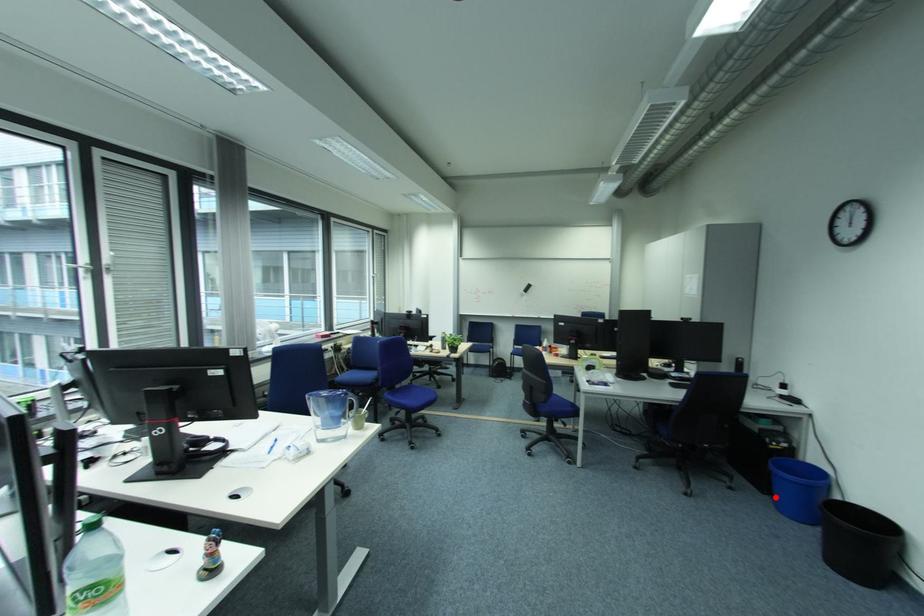
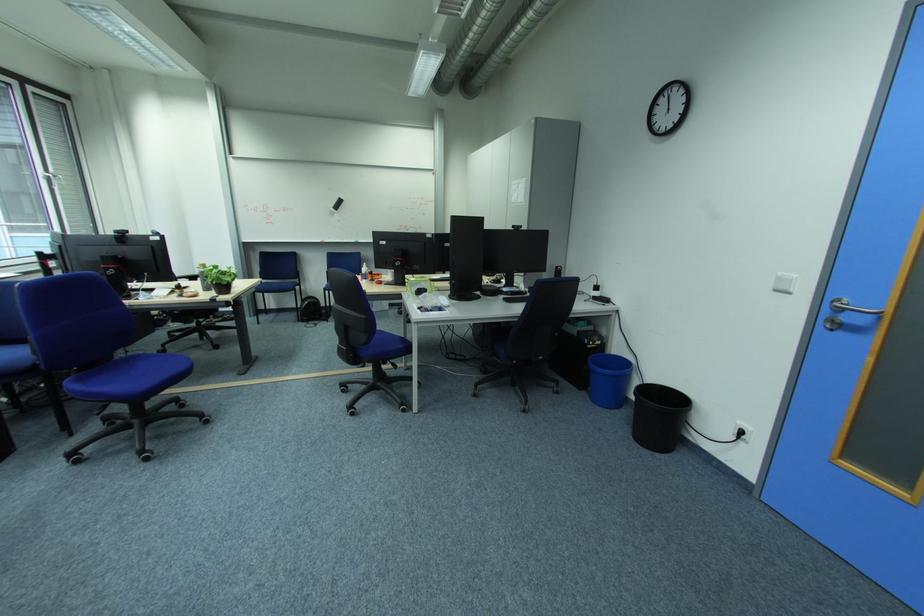
In the second image, find the point that corresponds to the highlighted location in the first image.

(592, 392)